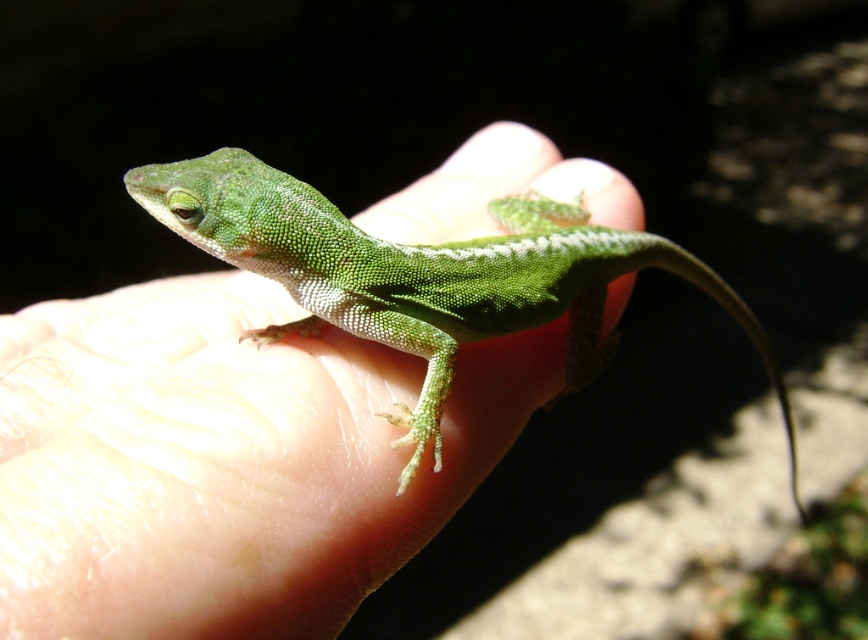
Question: In this image, where is green matte lizard at center located relative to green matte tail at center?

Choices:
 (A) below
 (B) above

Answer: (A)

Question: Which point is farther to the camera?

Choices:
 (A) green matte lizard at center
 (B) green matte tail at center

Answer: (B)

Question: Which point is farther to the camera?

Choices:
 (A) (607, 260)
 (B) (366, 324)

Answer: (A)

Question: Does green matte lizard at center have a larger size compared to green matte tail at center?

Choices:
 (A) yes
 (B) no

Answer: (A)

Question: Is green matte lizard at center above green matte tail at center?

Choices:
 (A) no
 (B) yes

Answer: (A)